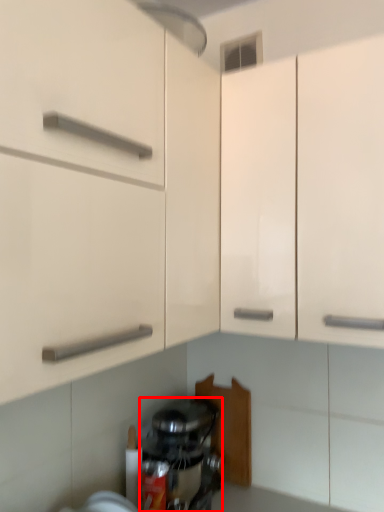
Question: Where is home appliance (annotated by the red box) located in relation to cabinetry in the image?

Choices:
 (A) left
 (B) right

Answer: (A)